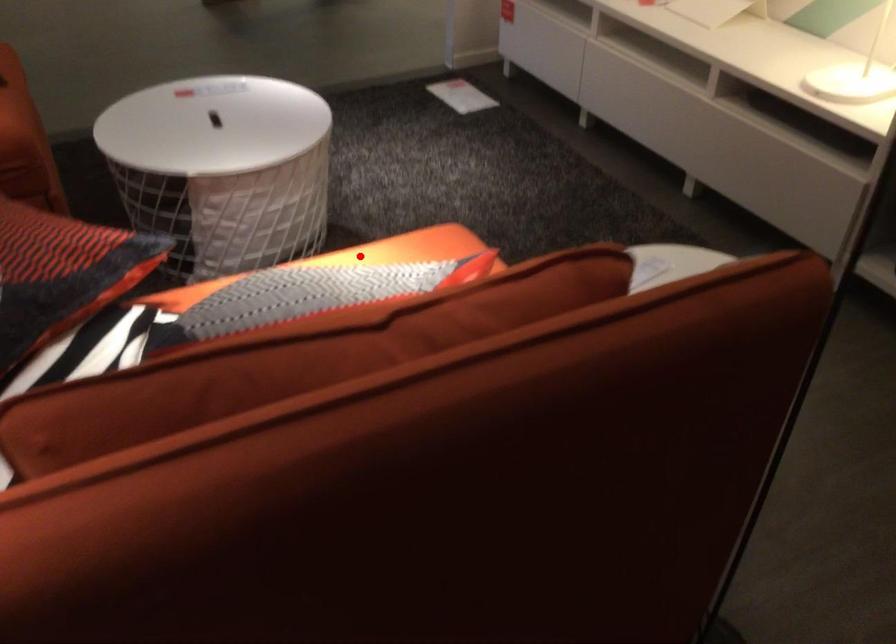
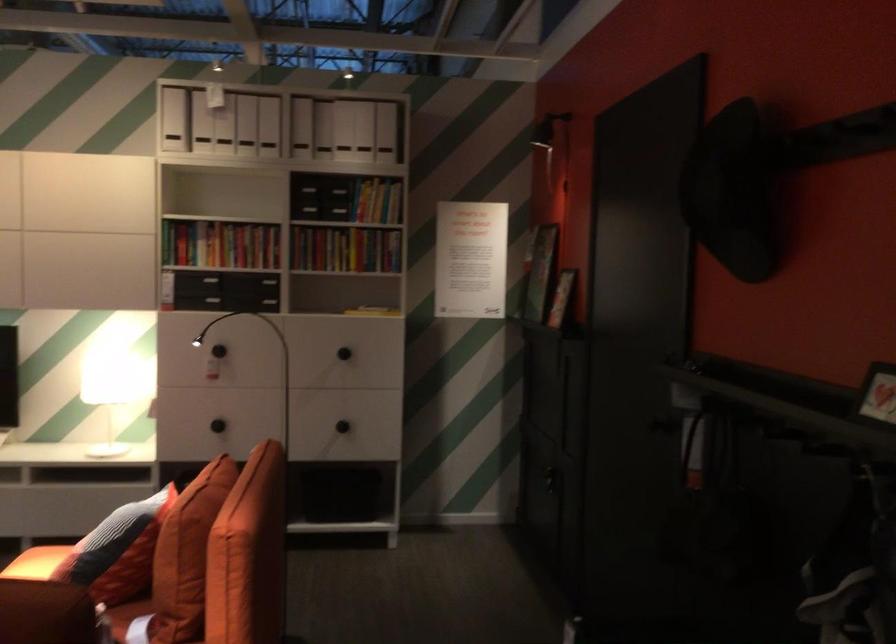
Question: I am providing you with two images of the same scene from different viewpoints. Given a red point in image1, look at the same physical point in image2. Is it:

Choices:
 (A) Closer to the viewpoint
 (B) Farther from the viewpoint

Answer: (B)